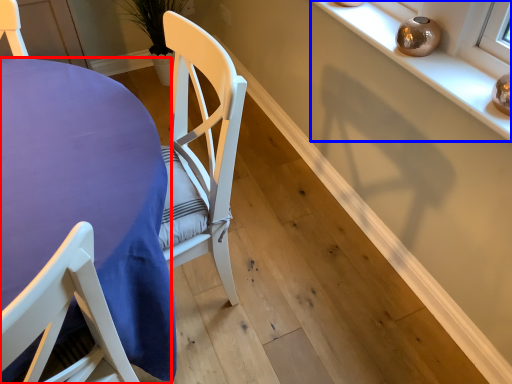
Question: Which of the following is the farthest to the observer, table (highlighted by a red box) or shelf (highlighted by a blue box)?

Choices:
 (A) table
 (B) shelf

Answer: (B)